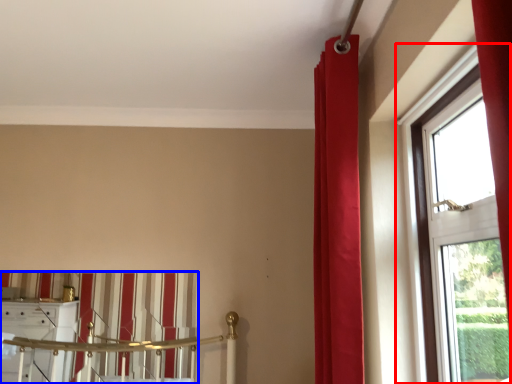
Question: Which point is closer to the camera, window (highlighted by a red box) or curtain (highlighted by a blue box)?

Choices:
 (A) window
 (B) curtain

Answer: (A)